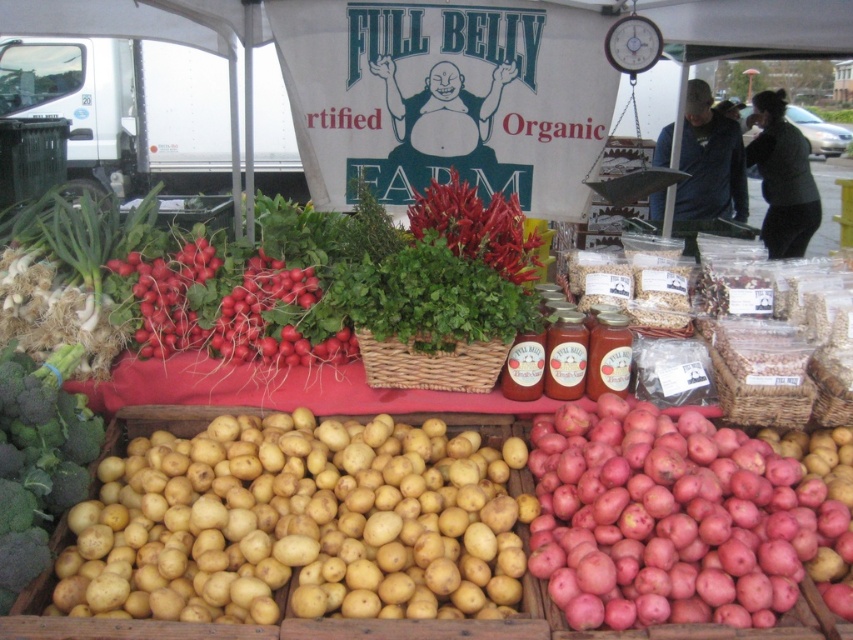
Which is in front, point (363, 609) or point (608, 458)?

Point (363, 609) is more forward.

Between yellow matte potatoes at lower left and red matte potatoes at lower right, which one appears on the left side from the viewer's perspective?

Positioned to the left is yellow matte potatoes at lower left.

The image size is (853, 640). Find the location of `yellow matte potatoes at lower left`. yellow matte potatoes at lower left is located at coordinates (297, 524).

Between green leafy vegetables at left and bright red chili peppers at center, which one appears on the left side from the viewer's perspective?

green leafy vegetables at left

Is green leafy vegetables at left above bright red chili peppers at center?

No.

Between point (38, 259) and point (509, 228), which one is positioned behind?

Point (38, 259)

The height and width of the screenshot is (640, 853). In order to click on green leafy vegetables at left in this screenshot , I will do `click(67, 275)`.

From the picture: Can you confirm if red matte radish at center is taller than green leafy broccoli at lower left?

In fact, red matte radish at center may be shorter than green leafy broccoli at lower left.

Between red matte radish at center and green leafy broccoli at lower left, which one has less height?

With less height is red matte radish at center.

Who is more forward, (253, 298) or (70, 396)?

Point (70, 396) is in front.

Locate an element on the screen. This screenshot has width=853, height=640. red matte radish at center is located at coordinates (228, 310).